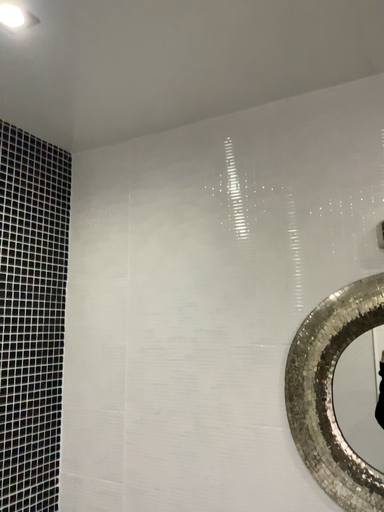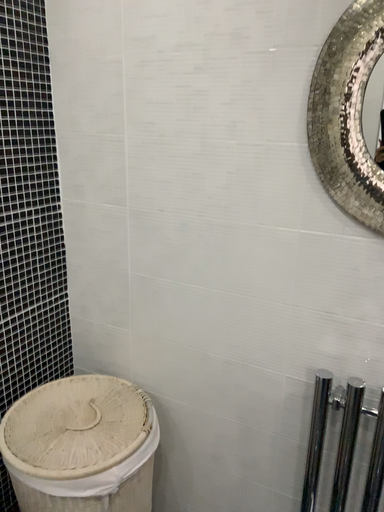
Question: How did the camera likely rotate when shooting the video?

Choices:
 (A) rotated downward
 (B) rotated upward

Answer: (A)